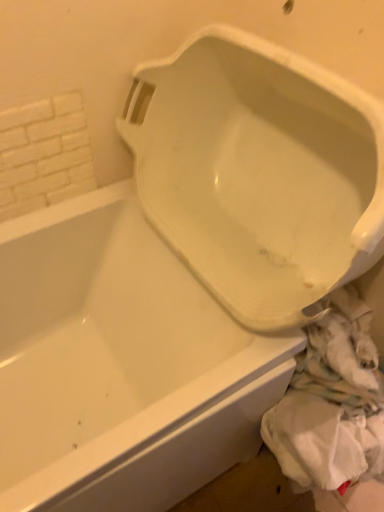
Question: Is white brick wall at upper left facing towards white glossy urinal at center?

Choices:
 (A) yes
 (B) no

Answer: (B)

Question: Are white brick wall at upper left and white glossy urinal at center making contact?

Choices:
 (A) no
 (B) yes

Answer: (A)

Question: Does white brick wall at upper left have a lesser width compared to white glossy urinal at center?

Choices:
 (A) no
 (B) yes

Answer: (B)

Question: Can you confirm if white brick wall at upper left is shorter than white glossy urinal at center?

Choices:
 (A) yes
 (B) no

Answer: (A)

Question: From a real-world perspective, is white brick wall at upper left physically above white glossy urinal at center?

Choices:
 (A) yes
 (B) no

Answer: (A)

Question: Is white brick wall at upper left further to the viewer compared to white glossy urinal at center?

Choices:
 (A) yes
 (B) no

Answer: (A)

Question: Is white glossy urinal at center directly adjacent to white fabric at lower right?

Choices:
 (A) no
 (B) yes

Answer: (A)

Question: Does white glossy urinal at center have a lesser width compared to white fabric at lower right?

Choices:
 (A) yes
 (B) no

Answer: (B)

Question: From a real-world perspective, is white glossy urinal at center on top of white fabric at lower right?

Choices:
 (A) yes
 (B) no

Answer: (A)

Question: Is white glossy urinal at center at the left side of white fabric at lower right?

Choices:
 (A) no
 (B) yes

Answer: (B)

Question: Is white glossy urinal at center oriented towards white fabric at lower right?

Choices:
 (A) no
 (B) yes

Answer: (A)

Question: Does white glossy urinal at center have a greater height compared to white fabric at lower right?

Choices:
 (A) no
 (B) yes

Answer: (B)

Question: From the image's perspective, is white brick wall at upper left on top of white fabric at lower right?

Choices:
 (A) no
 (B) yes

Answer: (B)